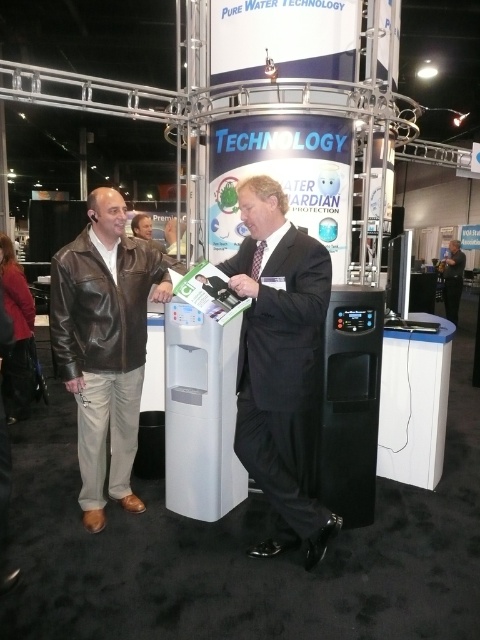
You are a photographer at the exhibition. You need to take a group photo of the two men at the booth. Since the black suit at center and dark suit at center are standing close to each other, which one should you position slightly to the side to avoid blocking the other?

The black suit at center is thinner than the dark suit at center, so positioning the black suit at center slightly to the side would prevent it from being blocked by the wider dark suit at center.

You are organizing a booth layout for an exhibition. You have a limited space and need to place the brown leather jacket at left and the dark suit at center. Based on their sizes, which one can be placed closer to the entrance to save space?

The brown leather jacket at left occupies less space than the dark suit at center, so placing the brown leather jacket at left closer to the entrance would save more space.